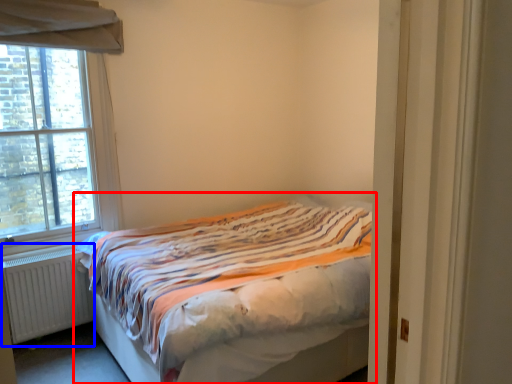
Question: Which point is further to the camera, bed (highlighted by a red box) or radiator (highlighted by a blue box)?

Choices:
 (A) bed
 (B) radiator

Answer: (B)